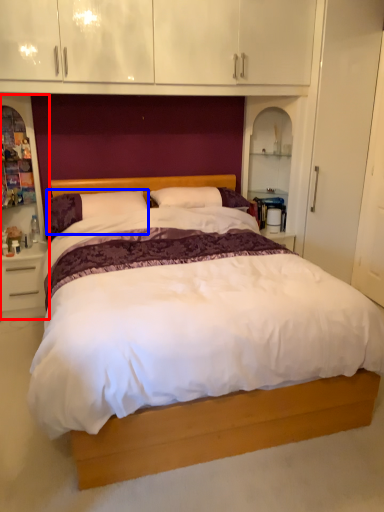
Question: Which object appears farthest to the camera in this image, dresser (highlighted by a red box) or pillow (highlighted by a blue box)?

Choices:
 (A) dresser
 (B) pillow

Answer: (B)